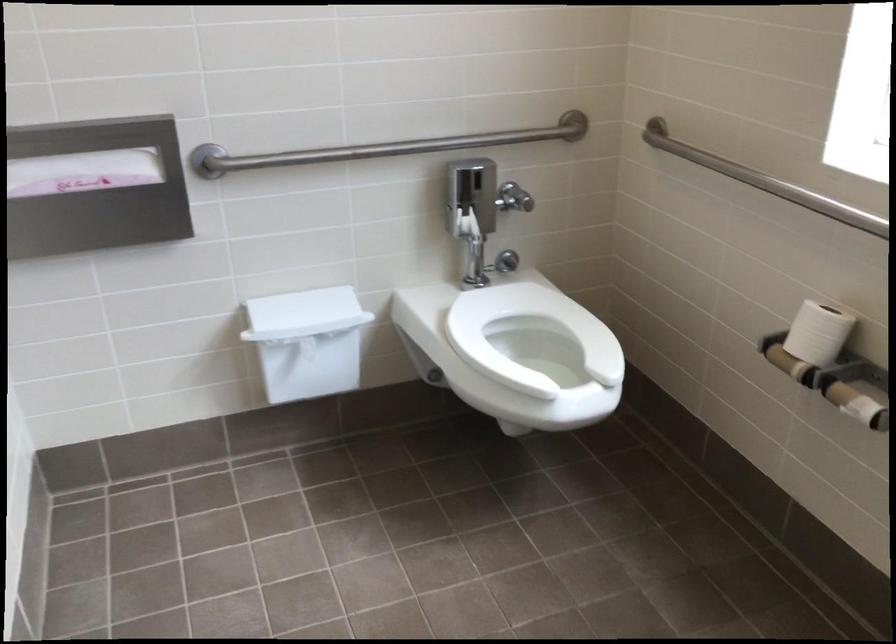
Image resolution: width=896 pixels, height=644 pixels. Describe the element at coordinates (304, 314) in the screenshot. I see `the white bin lid` at that location.